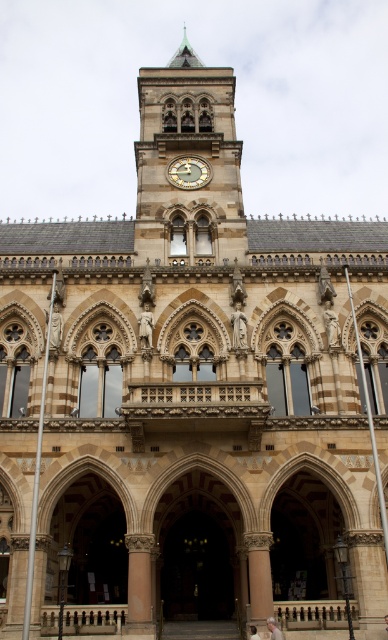
Question: Can you confirm if light brown wooden chair at lower center is positioned above light brown leather jacket at center?

Choices:
 (A) no
 (B) yes

Answer: (B)

Question: Can you confirm if golden polished clock tower at center is positioned above wooden clock face at center?

Choices:
 (A) yes
 (B) no

Answer: (A)

Question: Can you confirm if wooden clock face at center is thinner than light brown leather jacket at center?

Choices:
 (A) yes
 (B) no

Answer: (B)

Question: Among these points, which one is nearest to the camera?

Choices:
 (A) (199, 150)
 (B) (251, 632)
 (C) (266, 624)
 (D) (195, 176)

Answer: (C)

Question: Estimate the real-world distances between objects in this image. Which object is closer to the light brown wooden chair at lower center?

Choices:
 (A) light brown leather jacket at center
 (B) wooden clock face at center

Answer: (A)

Question: Which of these objects is positioned farthest from the light brown leather jacket at center?

Choices:
 (A) golden polished clock tower at center
 (B) light brown wooden chair at lower center

Answer: (A)